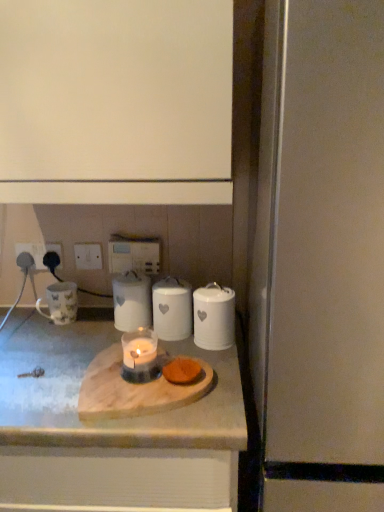
Locate an element on the screen. This screenshot has width=384, height=512. spots to the right of white glossy mug at left, which appears as the 5th appliance when viewed from the right is located at coordinates (95, 324).